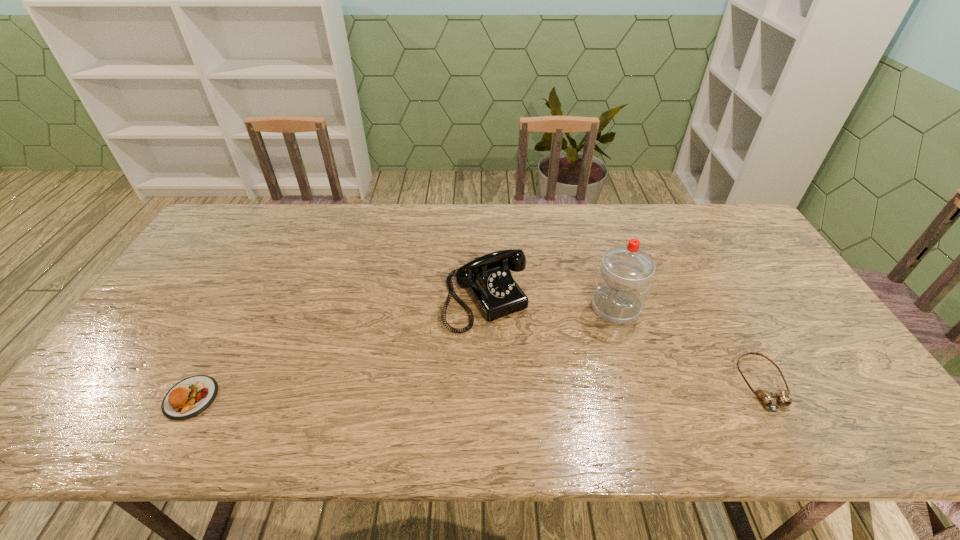
This screenshot has width=960, height=540. In order to click on patty (food) in this screenshot , I will do `click(191, 396)`.

Locate an element on the screen. The width and height of the screenshot is (960, 540). the leftmost object is located at coordinates (191, 396).

At what (x,y) coordinates should I click in order to perform the action: click on the shortest object. Please return your answer as a coordinate pair (x, y). Looking at the image, I should click on (767, 397).

Image resolution: width=960 pixels, height=540 pixels. Identify the location of goggles. (767, 397).

Find the location of `the tallest object`. the tallest object is located at coordinates (624, 278).

Identify the location of the second object from right to left. This screenshot has height=540, width=960. (624, 278).

At what (x,y) coordinates should I click in order to perform the action: click on the third shortest object. Please return your answer as a coordinate pair (x, y). Looking at the image, I should click on (488, 280).

Locate an element on the screen. telephone is located at coordinates (488, 280).

The width and height of the screenshot is (960, 540). In order to click on vacant space located 0.290m on the back of the patty (food) in this screenshot , I will do `click(248, 293)`.

I want to click on vacant space situated on the handle side of the second object from right to left, so click(583, 345).